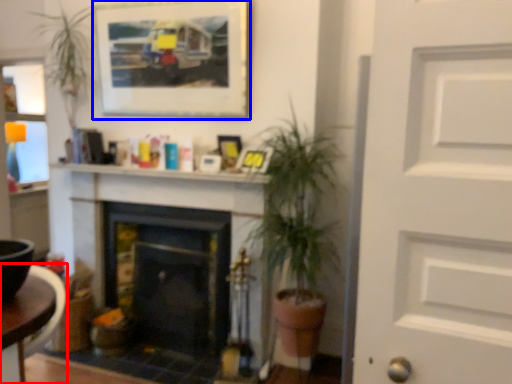
Question: Among these objects, which one is nearest to the camera, table (highlighted by a red box) or picture frame (highlighted by a blue box)?

Choices:
 (A) table
 (B) picture frame

Answer: (A)